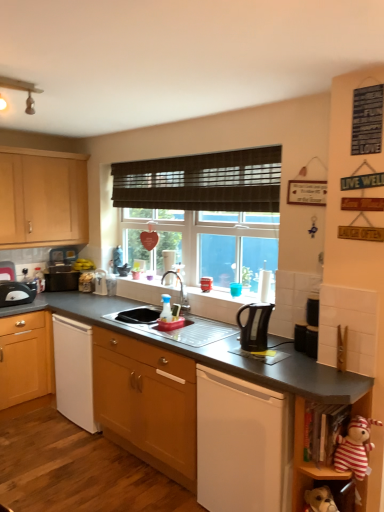
At what (x,y) coordinates should I click in order to perform the action: click on free space in front of black plastic toaster at left, acting as the 2th appliance starting from the bottom. Please return your answer as a coordinate pair (x, y). The height and width of the screenshot is (512, 384). Looking at the image, I should click on (62, 293).